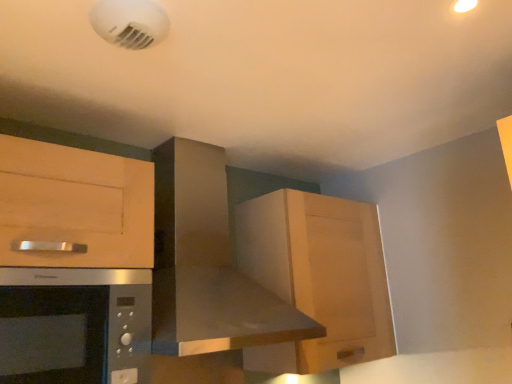
This screenshot has width=512, height=384. What are the coordinates of `empty space that is ontop of stainless steel range hood at center` in the screenshot? It's located at (205, 128).